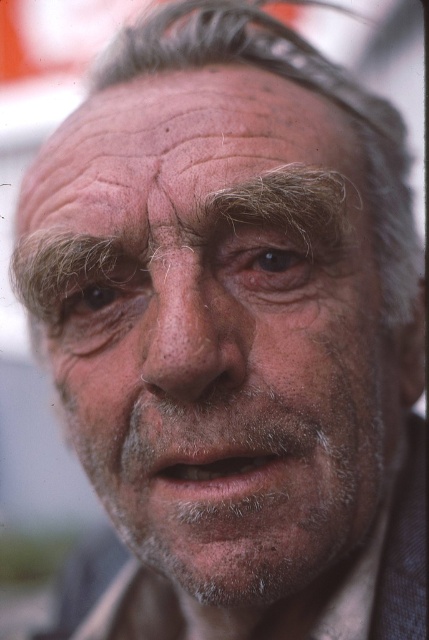
Question: Among these objects, which one is farthest from the camera?

Choices:
 (A) dry skin nose at center
 (B) gray/short hair at center
 (C) gray textured eyebrow at upper center
 (D) brown matte eye at upper left

Answer: (B)

Question: Is dry skin face at center further to the viewer compared to dry skin nose at center?

Choices:
 (A) no
 (B) yes

Answer: (A)

Question: Is gray/short hair at center further to the viewer compared to dry skin nose at center?

Choices:
 (A) yes
 (B) no

Answer: (A)

Question: Which of the following is the closest to the observer?

Choices:
 (A) gray textured eyebrow at upper center
 (B) dry skin nose at center
 (C) brown textured eye at center
 (D) dry skin face at center

Answer: (D)

Question: Is gray/short hair at center thinner than brown textured eye at center?

Choices:
 (A) yes
 (B) no

Answer: (B)

Question: Which of these objects is positioned farthest from the dry skin nose at center?

Choices:
 (A) gray/short hair at center
 (B) gray textured eyebrow at upper center
 (C) brown matte eye at upper left
 (D) dry skin face at center

Answer: (A)